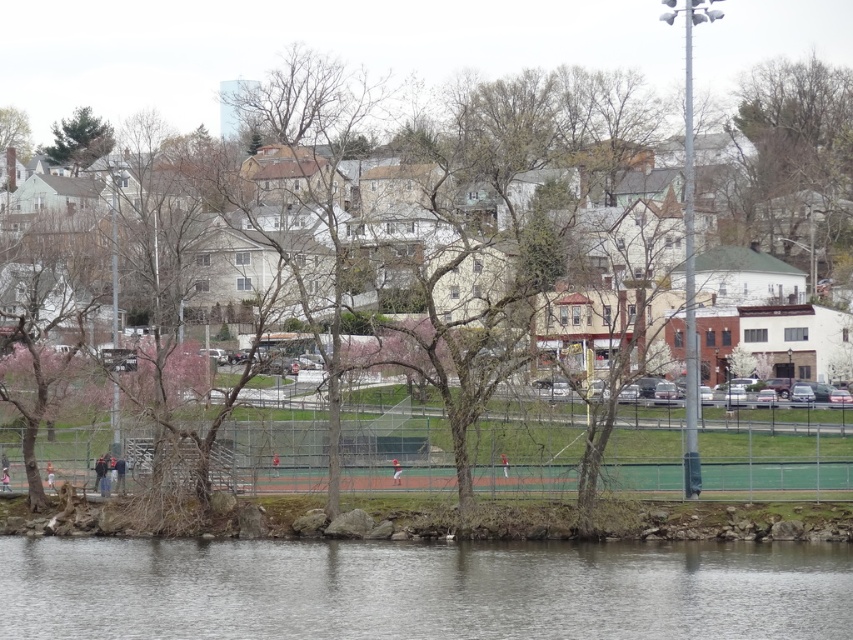
Question: Which point is closer to the camera?

Choices:
 (A) (113, 138)
 (B) (265, 598)
 (C) (506, 474)

Answer: (B)

Question: Does gray smooth water at lower center have a larger size compared to light brown wooden bench at lower left?

Choices:
 (A) no
 (B) yes

Answer: (B)

Question: Which point is closer to the camera?

Choices:
 (A) (97, 595)
 (B) (68, 161)
 (C) (45, 480)

Answer: (A)

Question: Can you confirm if red fabric person at lower left is positioned below red fabric person at center?

Choices:
 (A) yes
 (B) no

Answer: (A)

Question: Which of these objects is positioned farthest from the gray smooth water at lower center?

Choices:
 (A) matte baseball uniform at center
 (B) red fabric person at center

Answer: (A)

Question: Does light brown wooden bench at lower left lie in front of matte baseball uniform at center?

Choices:
 (A) no
 (B) yes

Answer: (A)